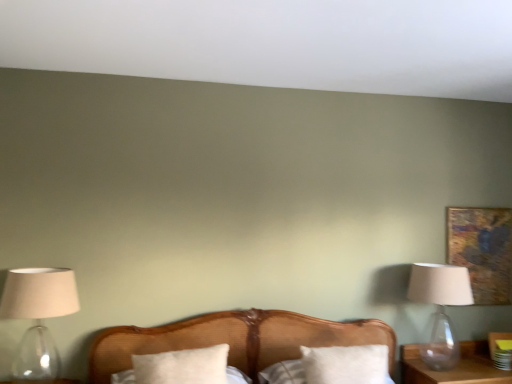
Question: Is wooden bed at center spatially inside translucent glass lampshade at left, the 1th lamp positioned from the front, or outside of it?

Choices:
 (A) inside
 (B) outside

Answer: (B)

Question: From a real-world perspective, is wooden bed at center physically located above or below translucent glass lampshade at left, the second lamp viewed from the right?

Choices:
 (A) above
 (B) below

Answer: (B)

Question: Estimate the real-world distances between objects in this image. Which object is farther from the gold textured painting at upper right?

Choices:
 (A) white soft pillow at center, the second pillow positioned from the left
 (B) transparent glass lamp at right, acting as the 1th lamp starting from the back
 (C) white soft pillow at center, which is the first pillow in left-to-right order
 (D) translucent glass lampshade at left, the 2th lamp positioned from the back
 (E) wooden bed at center

Answer: (D)

Question: Estimate the real-world distances between objects in this image. Which object is closer to the white soft pillow at center, which appears as the 2th pillow when viewed from the right?

Choices:
 (A) gold textured painting at upper right
 (B) translucent glass lampshade at left, which is counted as the first lamp, starting from the left
 (C) wooden bed at center
 (D) transparent glass lamp at right, acting as the 1th lamp starting from the back
 (E) white soft pillow at center, the 1th pillow viewed from the right

Answer: (C)